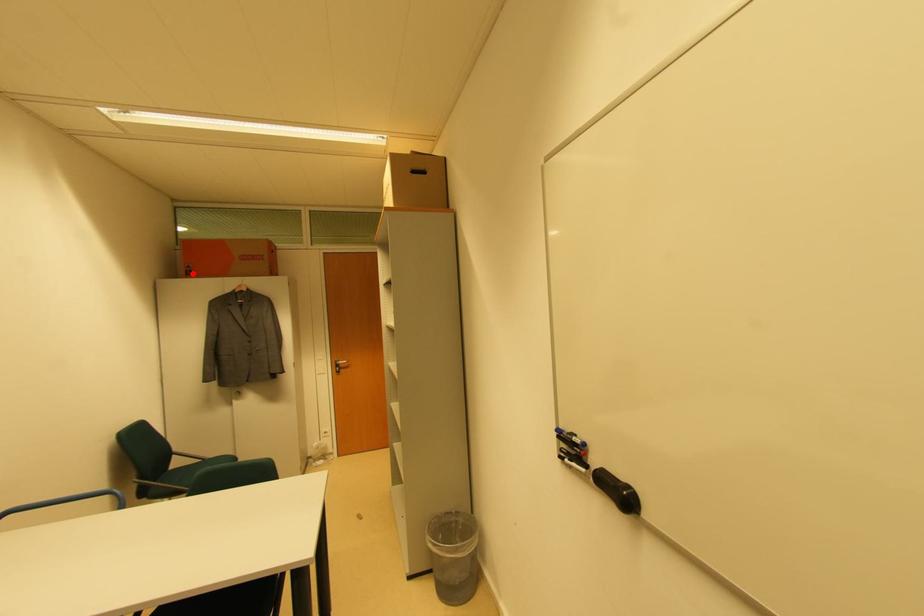
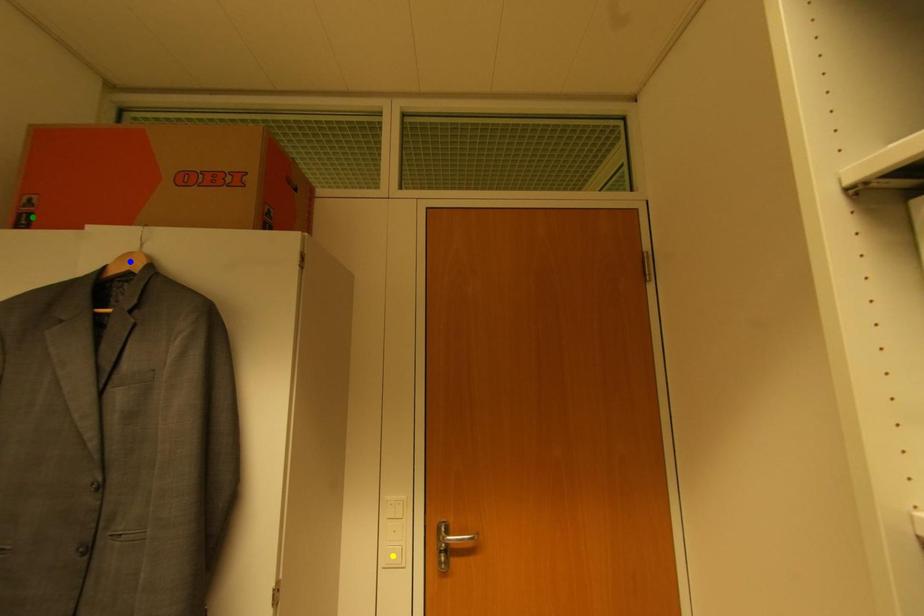
Question: I am providing you with two images of the same scene from different viewpoints. A red point is marked on the first image. You are given multiple points on the second image. Which point in image 2 is actually the same real-world point as the red point in image 1?

Choices:
 (A) green point
 (B) yellow point
 (C) blue point

Answer: (A)